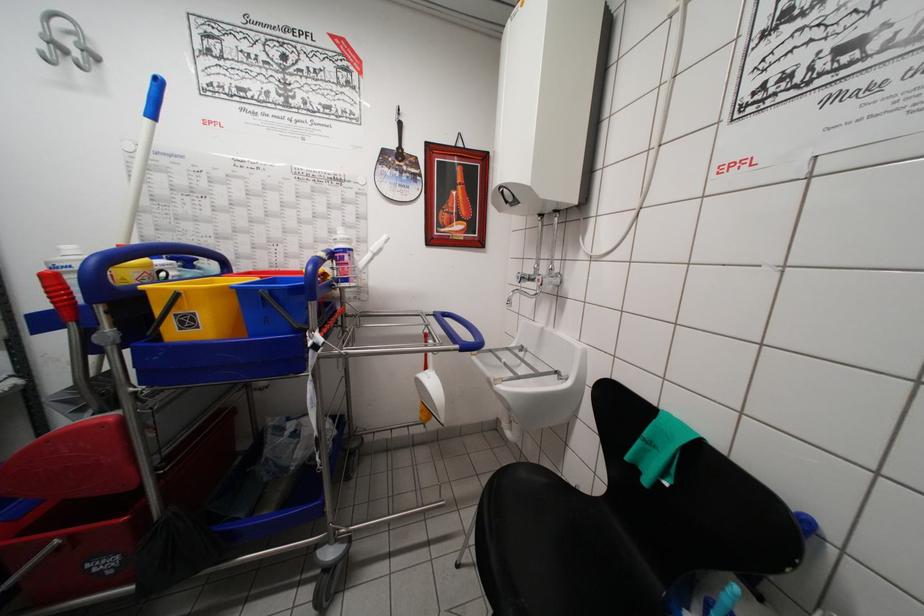
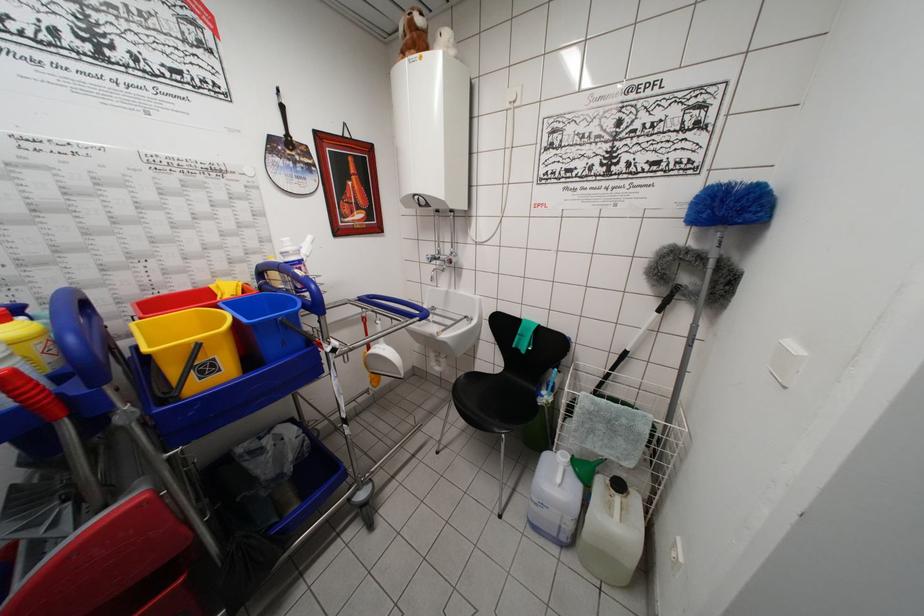
The point at (436, 317) is marked in the first image. Where is the corresponding point in the second image?

(360, 302)